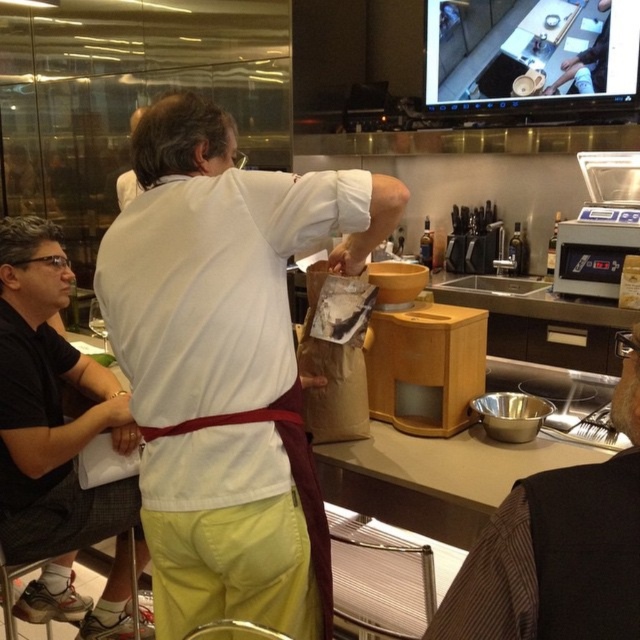
Does point (218, 525) come farther from viewer compared to point (598, 568)?

Yes.

Between white matte shirt at center and brown fabric vest at lower right, which one appears on the right side from the viewer's perspective?

brown fabric vest at lower right is more to the right.

Is point (177, 628) positioned after point (604, 611)?

Yes, point (177, 628) is farther from viewer.

Identify the location of white matte shirt at center. Image resolution: width=640 pixels, height=640 pixels. (225, 364).

Can you confirm if white matte shirt at center is bigger than black fabric shirt at left?

No.

Consider the image. Is white matte shirt at center to the right of black fabric shirt at left from the viewer's perspective?

Yes, white matte shirt at center is to the right of black fabric shirt at left.

Does point (212, 328) come in front of point (124, 634)?

That is True.

Where is `white matte shirt at center`? white matte shirt at center is located at coordinates click(225, 364).

Can you confirm if black fabric shirt at left is taller than brown fabric vest at lower right?

Yes.

Does black fabric shirt at left have a smaller size compared to brown fabric vest at lower right?

No, black fabric shirt at left is not smaller than brown fabric vest at lower right.

Locate an element on the screen. Image resolution: width=640 pixels, height=640 pixels. black fabric shirt at left is located at coordinates (56, 440).

Where is `black fabric shirt at left`? Image resolution: width=640 pixels, height=640 pixels. black fabric shirt at left is located at coordinates (56, 440).